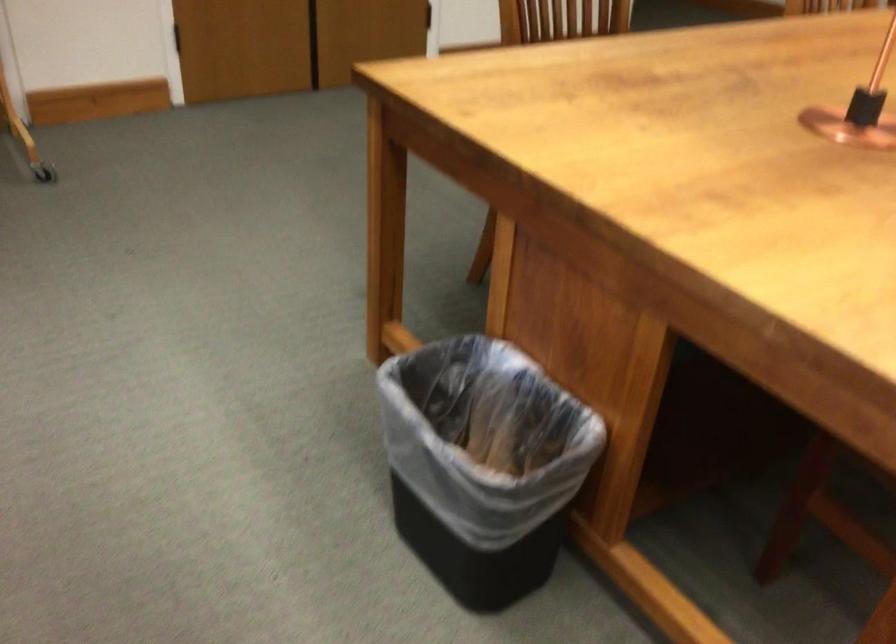
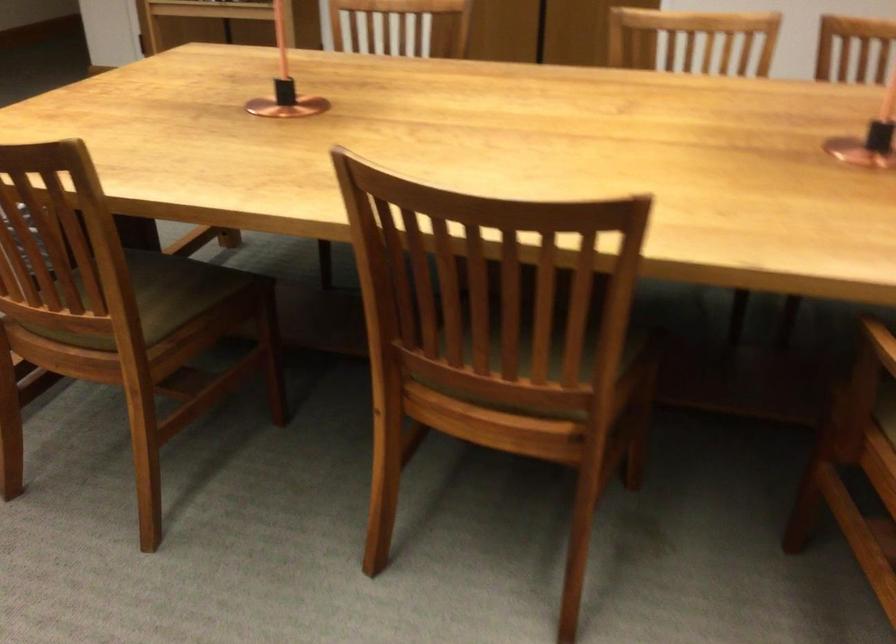
Question: I am providing you with two images of the same scene from different viewpoints. After the viewpoint changes to image2, which objects are now occluded?

Choices:
 (A) green chair sitting surface
 (B) glass water bottle
 (C) black trash can
 (D) copper table object

Answer: (C)